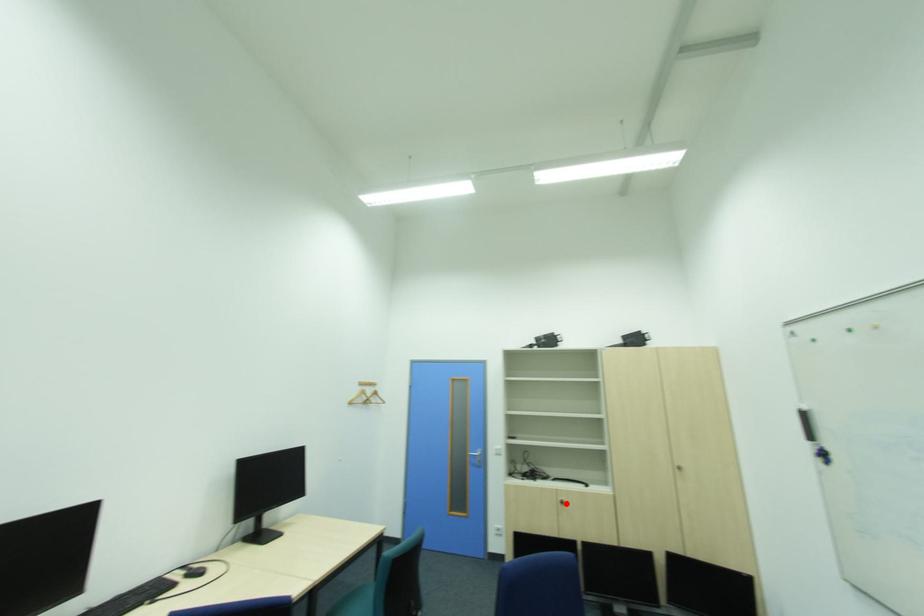
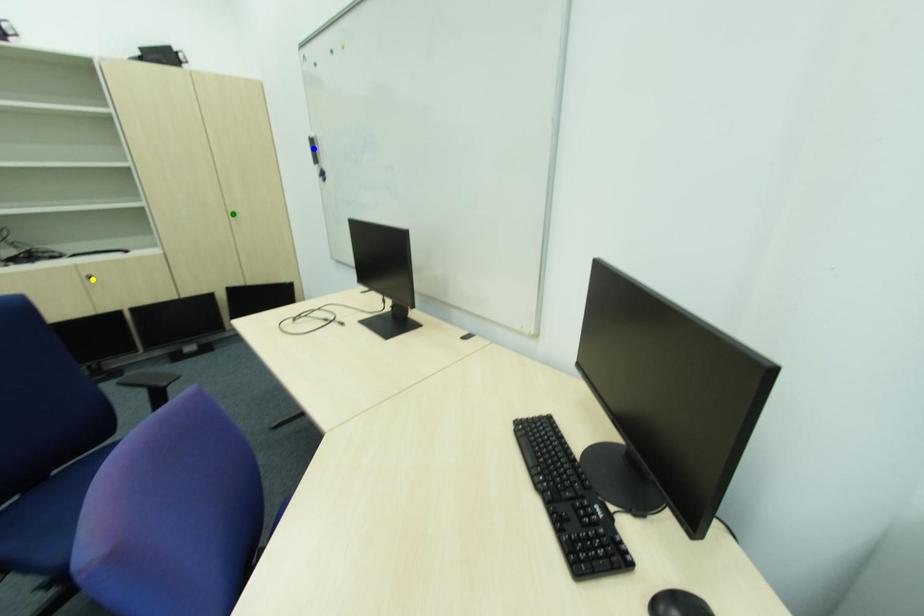
Question: I am providing you with two images of the same scene from different viewpoints. A red point is marked on the first image. You are given multiple points on the second image. Which point in image 2 represents the same 3d spot as the red point in image 1?

Choices:
 (A) green point
 (B) yellow point
 (C) blue point

Answer: (B)